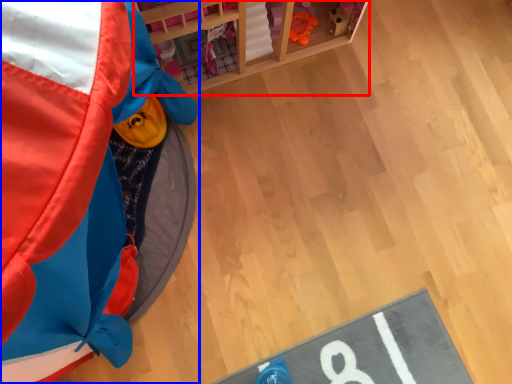
Question: Which of the following is the closest to the observer, furniture (highlighted by a red box) or toy (highlighted by a blue box)?

Choices:
 (A) furniture
 (B) toy

Answer: (B)